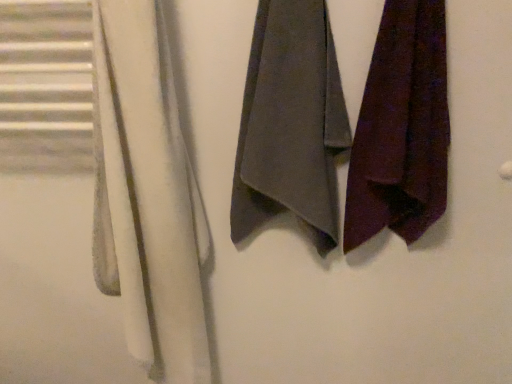
Question: Is dark purple fabric at right, the first towel when ordered from right to left, further to camera compared to dark gray fabric towel at center, which ranks as the first towel in left-to-right order?

Choices:
 (A) yes
 (B) no

Answer: (B)

Question: Considering the relative sizes of dark purple fabric at right, the first towel when ordered from right to left, and dark gray fabric towel at center, arranged as the 2th towel when viewed from the right, in the image provided, is dark purple fabric at right, the first towel when ordered from right to left, thinner than dark gray fabric towel at center, arranged as the 2th towel when viewed from the right,?

Choices:
 (A) yes
 (B) no

Answer: (B)

Question: From the image's perspective, is dark purple fabric at right, the first towel when ordered from right to left, below dark gray fabric towel at center, which ranks as the first towel in left-to-right order?

Choices:
 (A) no
 (B) yes

Answer: (B)

Question: Is dark purple fabric at right, the second towel positioned from the left, positioned with its back to dark gray fabric towel at center, which ranks as the first towel in left-to-right order?

Choices:
 (A) yes
 (B) no

Answer: (B)

Question: Does dark purple fabric at right, the second towel positioned from the left, appear on the left side of dark gray fabric towel at center, arranged as the 2th towel when viewed from the right?

Choices:
 (A) no
 (B) yes

Answer: (A)

Question: In terms of width, does dark gray fabric towel at center, which ranks as the first towel in left-to-right order, look wider or thinner when compared to white soft towel at left?

Choices:
 (A) thin
 (B) wide

Answer: (A)

Question: Does point (343, 104) appear closer or farther from the camera than point (139, 92)?

Choices:
 (A) closer
 (B) farther

Answer: (B)

Question: Would you say dark gray fabric towel at center, which ranks as the first towel in left-to-right order, is inside or outside white soft towel at left?

Choices:
 (A) inside
 (B) outside

Answer: (B)

Question: From the image's perspective, is dark gray fabric towel at center, arranged as the 2th towel when viewed from the right, positioned above or below white soft towel at left?

Choices:
 (A) below
 (B) above

Answer: (B)

Question: Is white soft towel at left in front of or behind dark gray fabric towel at center, which ranks as the first towel in left-to-right order, in the image?

Choices:
 (A) front
 (B) behind

Answer: (A)

Question: From a real-world perspective, is white soft towel at left positioned above or below dark gray fabric towel at center, arranged as the 2th towel when viewed from the right?

Choices:
 (A) below
 (B) above

Answer: (A)

Question: Is point (158, 119) positioned closer to the camera than point (293, 177)?

Choices:
 (A) closer
 (B) farther

Answer: (A)

Question: Looking at their shapes, would you say white soft towel at left is wider or thinner than dark gray fabric towel at center, which ranks as the first towel in left-to-right order?

Choices:
 (A) wide
 (B) thin

Answer: (A)

Question: Is dark purple fabric at right, the first towel when ordered from right to left, in front of or behind white soft towel at left in the image?

Choices:
 (A) behind
 (B) front

Answer: (A)

Question: Looking at their shapes, would you say dark purple fabric at right, the first towel when ordered from right to left, is wider or thinner than white soft towel at left?

Choices:
 (A) wide
 (B) thin

Answer: (B)